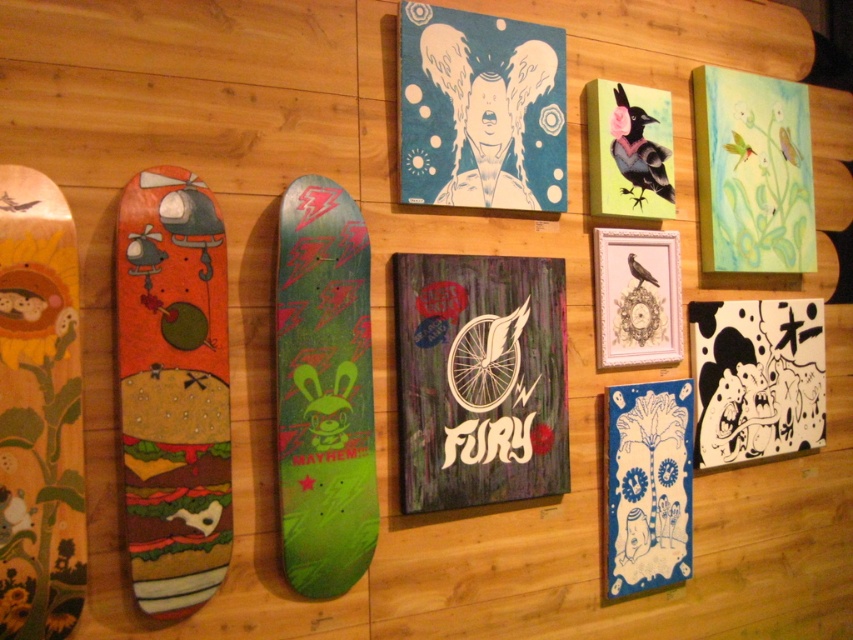
Question: Can you confirm if wooden textured bicycle at center is positioned above matte black bird at upper right?

Choices:
 (A) no
 (B) yes

Answer: (A)

Question: Is orange matte skateboard at left bigger than wooden skateboard with sunflower design at left?

Choices:
 (A) yes
 (B) no

Answer: (A)

Question: Among these points, which one is farthest from the camera?

Choices:
 (A) (662, 216)
 (B) (500, 204)
 (C) (711, 209)
 (D) (177, 307)

Answer: (C)

Question: Which point appears farthest from the camera in this image?

Choices:
 (A) (608, 470)
 (B) (734, 152)
 (C) (62, 604)

Answer: (B)

Question: Where is orange matte skateboard at left located in relation to pastel watercolor painting of birds and flowers at upper right in the image?

Choices:
 (A) left
 (B) right

Answer: (A)

Question: Which object is positioned farthest from the blue paper palm tree at lower right?

Choices:
 (A) wooden clock with bird at center
 (B) wooden textured bicycle at center
 (C) wooden skateboard with sunflower design at left
 (D) pastel watercolor painting of birds and flowers at upper right

Answer: (C)